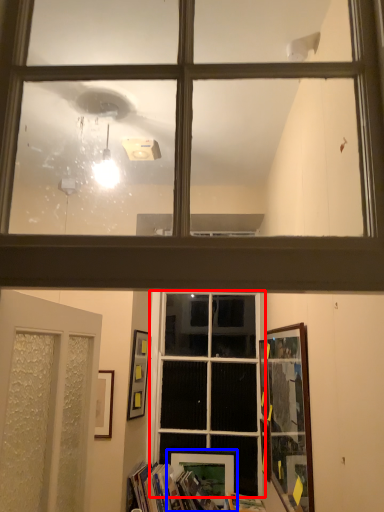
Question: Which object appears closest to the camera in this image, window (highlighted by a red box) or picture frame (highlighted by a blue box)?

Choices:
 (A) window
 (B) picture frame

Answer: (A)